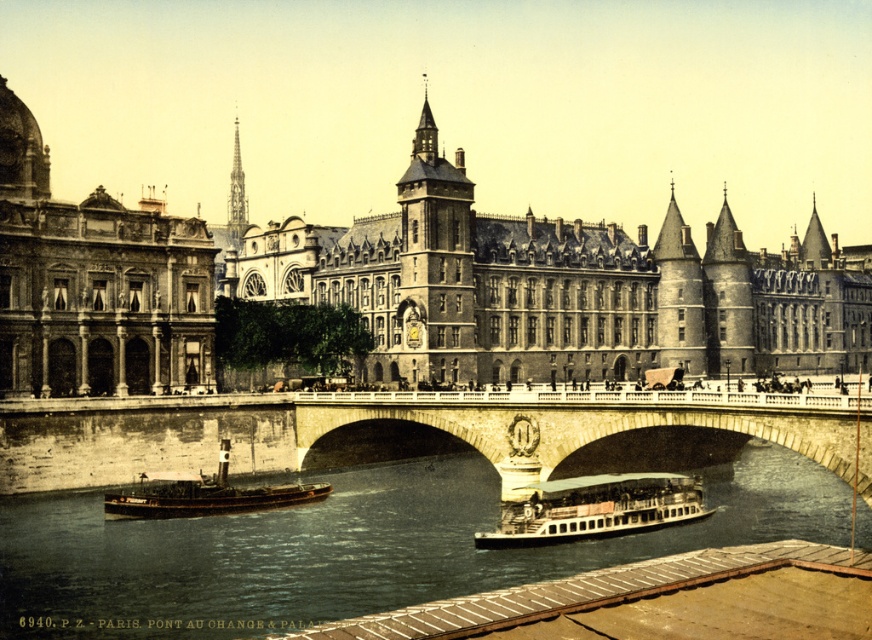
Between matte stone building at center and brown wooden boat at lower left, which one appears on the right side from the viewer's perspective?

Positioned to the right is matte stone building at center.

Is point (641, 300) farther from camera compared to point (167, 484)?

That is True.

Image resolution: width=872 pixels, height=640 pixels. What do you see at coordinates (405, 288) in the screenshot?
I see `matte stone building at center` at bounding box center [405, 288].

Find the location of a particular element. This screenshot has height=640, width=872. matte stone building at center is located at coordinates (405, 288).

How distant is matte stone building at center from brown water at center?

matte stone building at center and brown water at center are 96.07 feet apart.

Measure the distance from matte stone building at center to brown water at center.

matte stone building at center and brown water at center are 29.28 meters apart from each other.

Who is more distant from viewer, [814,216] or [257,600]?

Positioned behind is point [814,216].

At what (x,y) coordinates should I click in order to perform the action: click on matte stone building at center. Please return your answer as a coordinate pair (x, y). Image resolution: width=872 pixels, height=640 pixels. Looking at the image, I should click on (405, 288).

Which is below, brown water at center or smooth stone spire at upper center?

Positioned lower is brown water at center.

Is brown water at center to the left of smooth stone spire at upper center from the viewer's perspective?

In fact, brown water at center is to the right of smooth stone spire at upper center.

The height and width of the screenshot is (640, 872). I want to click on brown water at center, so click(x=351, y=547).